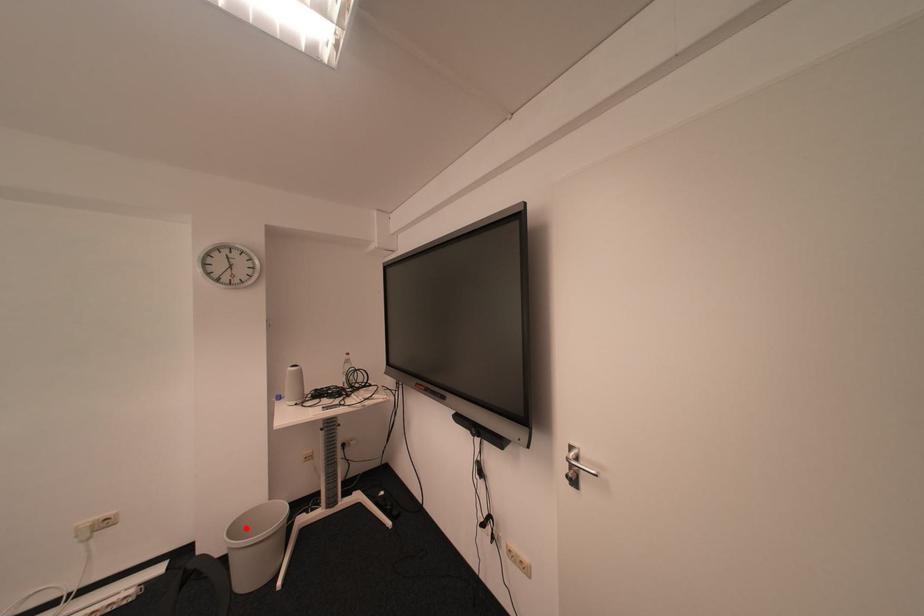
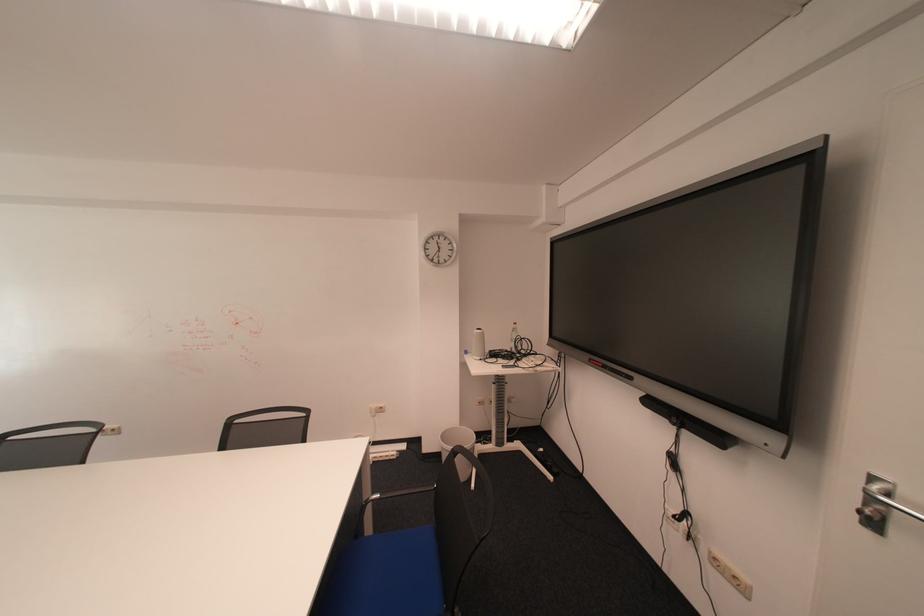
Where in the second image is the point corresponding to the highlighted location from the first image?

(456, 437)